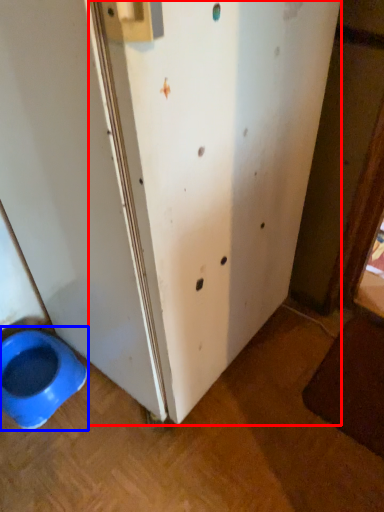
Question: Among these objects, which one is farthest to the camera, screen door (highlighted by a red box) or toilet (highlighted by a blue box)?

Choices:
 (A) screen door
 (B) toilet

Answer: (B)